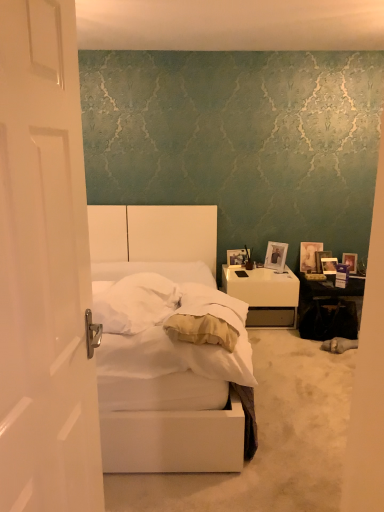
Question: Visually, is matte purple picture frame at right, acting as the first picture frame starting from the right, positioned to the left or to the right of white glossy door at left?

Choices:
 (A) right
 (B) left

Answer: (A)

Question: Is point (344, 257) positioned closer to the camera than point (26, 81)?

Choices:
 (A) farther
 (B) closer

Answer: (A)

Question: Which object is positioned farthest from the white soft pillow at center?

Choices:
 (A) white glossy door at left
 (B) matte silver picture frame at upper right, arranged as the second picture frame when viewed from the left
 (C) wooden photo frame at right, acting as the 1th picture frame starting from the left
 (D) matte purple picture frame at right, acting as the first picture frame starting from the right
 (E) white soft mattress at center

Answer: (D)

Question: Considering the real-world distances, which object is farthest from the wooden photo frame at right, marked as the 5th picture frame in a right-to-left arrangement?

Choices:
 (A) matte silver picture frame at upper right, arranged as the second picture frame when viewed from the left
 (B) white glossy door at left
 (C) metallic silver picture frame at upper right, which is the 4th picture frame in left-to-right order
 (D) wooden photo frame at right, which appears as the 3th picture frame when viewed from the left
 (E) white matte bed at center

Answer: (B)